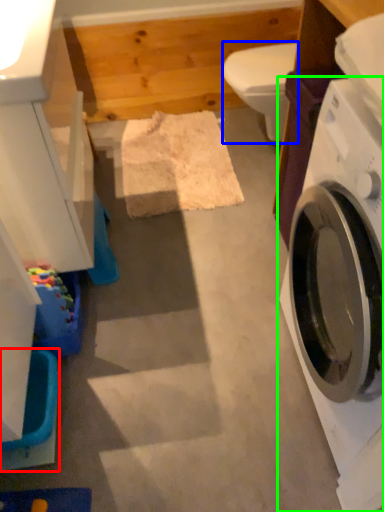
Question: Which object is positioned farthest from washer (highlighted by a red box)? Select from toilet bowl (highlighted by a blue box) and washing machine (highlighted by a green box).

Choices:
 (A) toilet bowl
 (B) washing machine

Answer: (A)